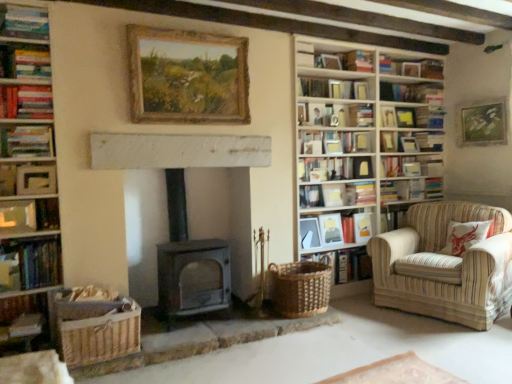
The width and height of the screenshot is (512, 384). What do you see at coordinates (98, 330) in the screenshot? I see `wooden woven basket at lower left, acting as the second basket starting from the right` at bounding box center [98, 330].

In order to click on matte white frame at upper right, marked as the 11th book in a top-to-bottom arrangement in this screenshot , I will do `click(335, 229)`.

The width and height of the screenshot is (512, 384). What do you see at coordinates (335, 229) in the screenshot?
I see `matte white frame at upper right, acting as the 3th book starting from the bottom` at bounding box center [335, 229].

What is the approximate width of wooden picture frame at upper right, which ranks as the second picture frame in top-to-bottom order?

It is 3.63 inches.

Describe the element at coordinates (309, 233) in the screenshot. I see `matte silver picture frame at center, the 2th picture frame from the front` at that location.

The image size is (512, 384). Find the location of `white textured pillow at right`. white textured pillow at right is located at coordinates tap(465, 236).

Which of these two, matte wooden picture frame at center, which is the 4th picture frame in front-to-back order, or woven brown basket at lower center, the 1th basket in the right-to-left sequence, is bigger?

woven brown basket at lower center, the 1th basket in the right-to-left sequence.

Locate an element on the screen. The image size is (512, 384). the 3rd picture frame positioned above the woven brown basket at lower center, marked as the 2th basket in a left-to-right arrangement (from a real-world perspective) is located at coordinates (331, 229).

Is matte wooden picture frame at center, which is the fourth picture frame from top to bottom, positioned behind woven brown basket at lower center, marked as the 2th basket in a left-to-right arrangement?

Yes, it is.

Is point (333, 232) positioned behind point (287, 295)?

Yes, point (333, 232) is behind point (287, 295).

Can we say wooden woven basket at lower left, which is counted as the first basket, starting from the left, lies outside wooden picture frame at upper right, the fifth picture frame viewed from the left?

That's correct, wooden woven basket at lower left, which is counted as the first basket, starting from the left, is outside of wooden picture frame at upper right, the fifth picture frame viewed from the left.

Are wooden woven basket at lower left, which is the 1th basket from front to back, and wooden picture frame at upper right, which ranks as the second picture frame in top-to-bottom order, beside each other?

No, wooden woven basket at lower left, which is the 1th basket from front to back, is not beside wooden picture frame at upper right, which ranks as the second picture frame in top-to-bottom order.

In order to click on the 2nd basket in front of the wooden picture frame at upper right, which ranks as the second picture frame in top-to-bottom order in this screenshot , I will do `click(98, 330)`.

Is wooden woven basket at lower left, which is counted as the first basket, starting from the left, smaller than woven brown basket at lower center, the second basket in the front-to-back sequence?

Indeed, wooden woven basket at lower left, which is counted as the first basket, starting from the left, has a smaller size compared to woven brown basket at lower center, the second basket in the front-to-back sequence.

Is wooden woven basket at lower left, which is the 1th basket from front to back, positioned behind woven brown basket at lower center, the 1th basket in the right-to-left sequence?

No, wooden woven basket at lower left, which is the 1th basket from front to back, is closer to the viewer.

Which is nearer, (104, 358) or (303, 280)?

Point (104, 358)

Would you say wooden woven basket at lower left, acting as the second basket starting from the right, is outside woven brown basket at lower center, marked as the 2th basket in a left-to-right arrangement?

Absolutely, wooden woven basket at lower left, acting as the second basket starting from the right, is external to woven brown basket at lower center, marked as the 2th basket in a left-to-right arrangement.

Based on the photo, is hardcover book at left, arranged as the sixth book when viewed from the top, thinner than matte white frame at upper left, which is counted as the 6th book, starting from the bottom?

In fact, hardcover book at left, arranged as the sixth book when viewed from the top, might be wider than matte white frame at upper left, which is counted as the 6th book, starting from the bottom.

Based on the photo, does hardcover book at left, which is the eighth book from bottom to top, contain matte white frame at upper left, which is counted as the 6th book, starting from the bottom?

No.

Which book is the 2nd one when counting from the front of the matte white frame at upper left, which is counted as the 6th book, starting from the bottom? Please provide its 2D coordinates.

[(26, 141)]

Considering the positions of objects hardcover book at left, arranged as the sixth book when viewed from the top, and wooden bookshelf at right in the image provided, who is in front, hardcover book at left, arranged as the sixth book when viewed from the top, or wooden bookshelf at right?

hardcover book at left, arranged as the sixth book when viewed from the top.

Who is shorter, hardcover book at left, arranged as the sixth book when viewed from the top, or wooden bookshelf at right?

With less height is hardcover book at left, arranged as the sixth book when viewed from the top.

Could you tell me if hardcover book at left, which is the eighth book from bottom to top, is turned towards wooden bookshelf at right?

No, hardcover book at left, which is the eighth book from bottom to top, is not oriented towards wooden bookshelf at right.

Considering the positions of points (47, 133) and (381, 141), is point (47, 133) farther from camera compared to point (381, 141)?

No.

Image resolution: width=512 pixels, height=384 pixels. I want to click on the 1st basket positioned below the hardcover books at left, which appears as the second book when ordered from the bottom (from the image's perspective), so click(x=300, y=288).

From the image's perspective, which is below, woven brown basket at lower center, marked as the 2th basket in a left-to-right arrangement, or hardcover books at left, which appears as the second book when ordered from the bottom?

woven brown basket at lower center, marked as the 2th basket in a left-to-right arrangement, is shown below in the image.

Considering the positions of objects woven brown basket at lower center, the second basket in the front-to-back sequence, and hardcover books at left, which appears as the second book when ordered from the bottom, in the image provided, who is more to the left, woven brown basket at lower center, the second basket in the front-to-back sequence, or hardcover books at left, which appears as the second book when ordered from the bottom,?

hardcover books at left, which appears as the second book when ordered from the bottom, is more to the left.

From a real-world perspective, is woven brown basket at lower center, the 1th basket in the right-to-left sequence, above or below hardcover books at left, acting as the twelfth book starting from the top?

Clearly, from a real-world perspective, woven brown basket at lower center, the 1th basket in the right-to-left sequence, is below hardcover books at left, acting as the twelfth book starting from the top.

From a real-world perspective, who is located lower, wooden woven basket at lower left, which is counted as the first basket, starting from the left, or white textured pillow at right?

wooden woven basket at lower left, which is counted as the first basket, starting from the left.

Does wooden woven basket at lower left, acting as the second basket starting from the right, contain white textured pillow at right?

No.

Does wooden woven basket at lower left, which is counted as the first basket, starting from the left, have a smaller size compared to white textured pillow at right?

Yes.

Which point is more forward, (x=138, y=312) or (x=462, y=251)?

Positioned in front is point (x=138, y=312).

Starting from the woven brown basket at lower center, the second basket in the front-to-back sequence, which picture frame is the 2nd one to the right? Please provide its 2D coordinates.

[(331, 229)]

Locate an element on the screen. The width and height of the screenshot is (512, 384). picture frame that is the 4th one when counting upward from the wooden woven basket at lower left, the 2th basket from the back (from the image's perspective) is located at coordinates (481, 122).

Looking at the image, which one is located further to woven brown basket at lower center, marked as the 2th basket in a left-to-right arrangement, wooden picture frame at upper right, which is the 4th picture frame from bottom to top, or woven basket at lower right, the thirteenth book viewed from the top?

wooden picture frame at upper right, which is the 4th picture frame from bottom to top, is further to woven brown basket at lower center, marked as the 2th basket in a left-to-right arrangement.

In the scene shown: Which object lies further to the anchor point hardcover book at center, placed as the 7th book when sorted from top to bottom, striped fabric armchair at right or matte white frame at upper left, the eighth book in the top-to-bottom sequence?

matte white frame at upper left, the eighth book in the top-to-bottom sequence, is further to hardcover book at center, placed as the 7th book when sorted from top to bottom.

Based on their spatial positions, is hardcover book at center, the 5th book in the top-to-bottom sequence, or hardcover book at upper right, the 2th book when ordered from top to bottom, further from woven brown basket at lower center, acting as the 1th basket starting from the back?

The object further to woven brown basket at lower center, acting as the 1th basket starting from the back, is hardcover book at upper right, the 2th book when ordered from top to bottom.

From the image, which object appears to be nearer to matte white frame at upper right, acting as the 3th book starting from the bottom, hardcover book at left, the tenth book viewed from the top, or matte wooden picture frame at center-right, marked as the third picture frame in a bottom-to-top arrangement?

matte wooden picture frame at center-right, marked as the third picture frame in a bottom-to-top arrangement.

Looking at the image, which one is located closer to hardcover book at left, the fourth book from the bottom, wooden bookshelf at right or matte white frame at upper left, which is counted as the 6th book, starting from the bottom?

matte white frame at upper left, which is counted as the 6th book, starting from the bottom, lies closer to hardcover book at left, the fourth book from the bottom, than the other object.

Estimate the real-world distances between objects in this image. Which object is further from hardcover book at upper left, marked as the 4th book in a top-to-bottom arrangement, matte wooden picture frame at center-right, marked as the third picture frame in a bottom-to-top arrangement, or hardcover book at center, placed as the 7th book when sorted from top to bottom?

The object further to hardcover book at upper left, marked as the 4th book in a top-to-bottom arrangement, is matte wooden picture frame at center-right, marked as the third picture frame in a bottom-to-top arrangement.

When comparing their distances from matte wooden picture frame at center-right, the 1th picture frame when ordered from back to front, does hardcover books at left, which is counted as the eleventh book, starting from the bottom, or matte blue book at upper left, which ranks as the 1th book in top-to-bottom order, seem closer?

hardcover books at left, which is counted as the eleventh book, starting from the bottom, is closer to matte wooden picture frame at center-right, the 1th picture frame when ordered from back to front.

From the image, which object appears to be nearer to hardcover book at left, the tenth book viewed from the top, hardcover book at center, which is counted as the seventh book, starting from the bottom, or hardcover books at left, acting as the twelfth book starting from the top?

The object closer to hardcover book at left, the tenth book viewed from the top, is hardcover books at left, acting as the twelfth book starting from the top.

Where is `picture frame located between matte wooden picture frame at center, which is the 4th picture frame in front-to-back order, and hardcover book at center, arranged as the 5th book when ordered from the bottom, in the left-right direction`? picture frame located between matte wooden picture frame at center, which is the 4th picture frame in front-to-back order, and hardcover book at center, arranged as the 5th book when ordered from the bottom, in the left-right direction is located at coordinates (362, 227).

The height and width of the screenshot is (384, 512). In order to click on wood burning stove between hardcover book at upper left, marked as the 4th book in a top-to-bottom arrangement, and white textured pillow at right from left to right in this screenshot , I will do `click(188, 261)`.

Where is `chair between woven brown basket at lower center, marked as the 2th basket in a left-to-right arrangement, and wooden picture frame at upper right, which ranks as the second picture frame in top-to-bottom order, in the horizontal direction`? The image size is (512, 384). chair between woven brown basket at lower center, marked as the 2th basket in a left-to-right arrangement, and wooden picture frame at upper right, which ranks as the second picture frame in top-to-bottom order, in the horizontal direction is located at coordinates (445, 266).

At what (x,y) coordinates should I click in order to perform the action: click on wood burning stove between wooden-framed painting at upper center, the fifth picture frame in the back-to-front sequence, and woven basket at lower right, the thirteenth book viewed from the top, in the vertical direction. Please return your answer as a coordinate pair (x, y). This screenshot has width=512, height=384. Looking at the image, I should click on (188, 261).